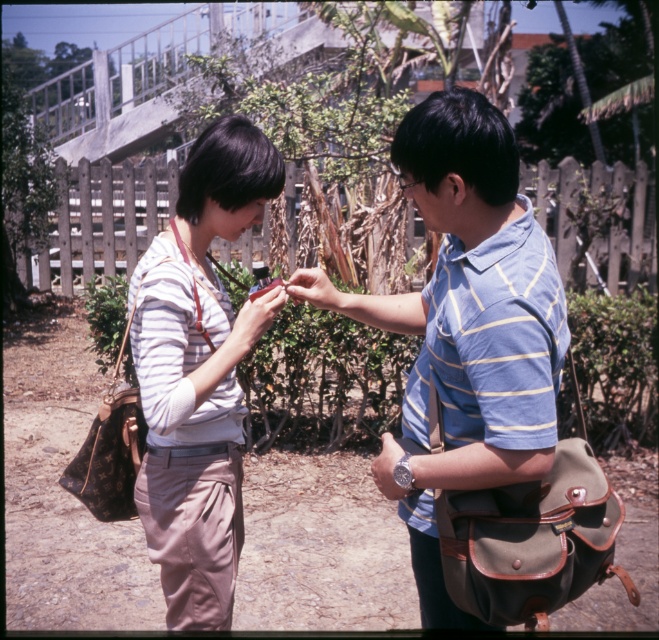
Question: Which of these objects is positioned farthest from the matte brown purse at center?

Choices:
 (A) matte brown purse at left
 (B) matte brown hand at center
 (C) matte green bag at right

Answer: (C)

Question: Which point is closer to the camera?

Choices:
 (A) matte brown purse at center
 (B) matte brown purse at left
 (C) matte brown hand at center

Answer: (B)

Question: Does matte green bag at right appear under matte brown purse at left?

Choices:
 (A) yes
 (B) no

Answer: (B)

Question: Does matte brown purse at left come behind matte brown purse at center?

Choices:
 (A) yes
 (B) no

Answer: (B)

Question: Which point is farther from the camera taking this photo?

Choices:
 (A) (418, 488)
 (B) (339, 291)
 (C) (183, 444)

Answer: (B)

Question: Can you confirm if matte brown purse at left is thinner than matte brown hand at center?

Choices:
 (A) yes
 (B) no

Answer: (B)